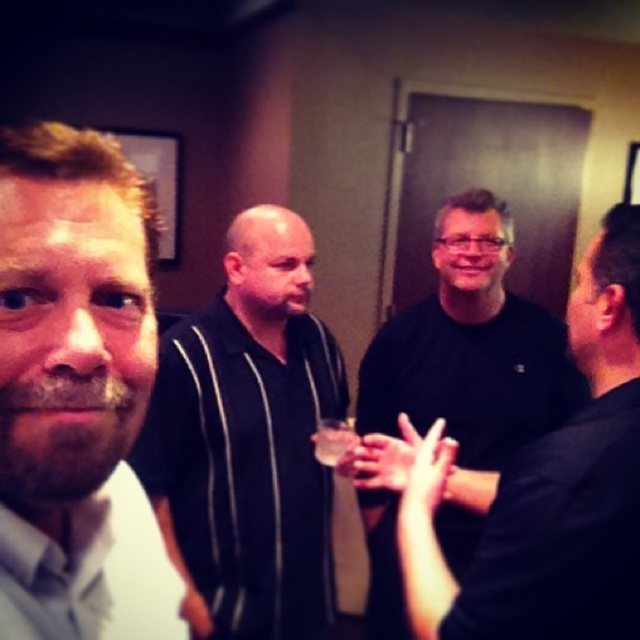
Question: Which point is closer to the camera?

Choices:
 (A) (282, 246)
 (B) (342, 429)

Answer: (B)

Question: Which of the following is the farthest from the observer?

Choices:
 (A) translucent glass beverage at center
 (B) black striped shirt at center
 (C) light brown hair at left
 (D) black matte shirt at center

Answer: (B)

Question: Is black matte shirt at center smaller than translucent glass beverage at center?

Choices:
 (A) no
 (B) yes

Answer: (A)

Question: Is black matte shirt at center to the right of translucent glass beverage at center from the viewer's perspective?

Choices:
 (A) no
 (B) yes

Answer: (B)

Question: Can you confirm if light brown hair at left is thinner than black matte shirt at center?

Choices:
 (A) yes
 (B) no

Answer: (A)

Question: Which of the following is the farthest from the observer?

Choices:
 (A) (193, 378)
 (B) (332, 452)
 (C) (419, 452)

Answer: (A)